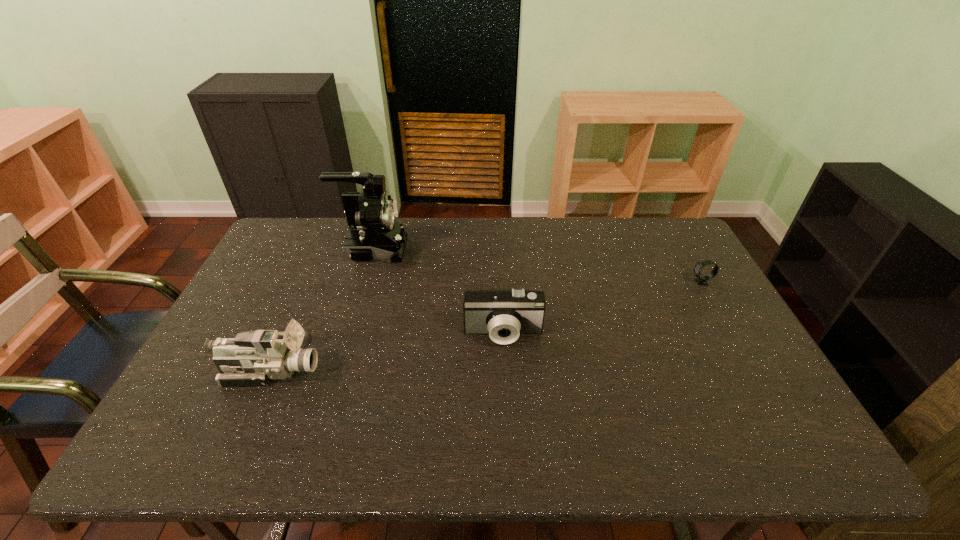
I want to click on the farthest camcorder, so click(374, 233).

You are a GUI agent. You are given a task and a screenshot of the screen. Output one action in this format:
    pyautogui.click(x=<x>, y=<y>)
    Task: Click on the tallest camcorder
    
    Given the screenshot: What is the action you would take?
    pyautogui.click(x=374, y=233)

Where is `the third shortest object`? Image resolution: width=960 pixels, height=540 pixels. the third shortest object is located at coordinates (253, 358).

You are a GUI agent. You are given a task and a screenshot of the screen. Output one action in this format:
    pyautogui.click(x=<x>, y=<y>)
    Task: Click on the nearest object
    The image size is (960, 540).
    Given the screenshot: What is the action you would take?
    pyautogui.click(x=253, y=358)

Where is `the second object from right to left`? The image size is (960, 540). the second object from right to left is located at coordinates (503, 314).

Locate an element on the screen. The height and width of the screenshot is (540, 960). the shortest camcorder is located at coordinates coord(503,314).

What are the coordinates of `the rightmost object` in the screenshot? It's located at (701, 280).

You are a GUI agent. You are given a task and a screenshot of the screen. Output one action in this format:
    pyautogui.click(x=<x>, y=<y>)
    Task: Click on the watch
    The width and height of the screenshot is (960, 540).
    Given the screenshot: What is the action you would take?
    pyautogui.click(x=701, y=280)

Identify the location of vacant region located on the lens mount of the farthest object. This screenshot has width=960, height=540. (448, 249).

This screenshot has height=540, width=960. What are the coordinates of `blank area located 0.230m on the front-facing side of the second shortest camcorder` in the screenshot? It's located at (409, 370).